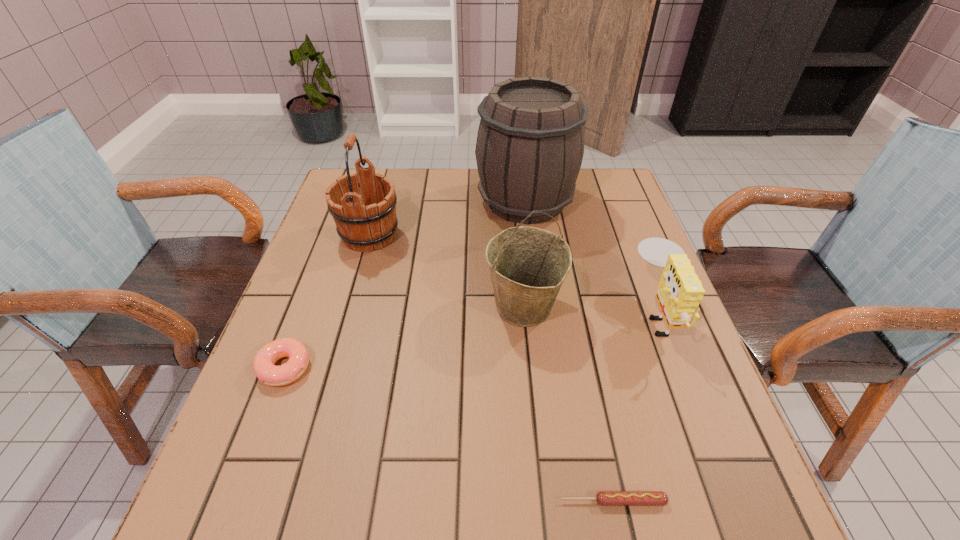
This screenshot has height=540, width=960. What are the coordinates of `sausage that is positioned at the right edge` in the screenshot? It's located at (604, 498).

I want to click on object positioned at the far right corner, so (530, 144).

Identify the location of object that is at the near right corner. (604, 498).

Locate an element on the screen. The height and width of the screenshot is (540, 960). free space at the far edge of the desktop is located at coordinates (460, 211).

The width and height of the screenshot is (960, 540). I want to click on vacant space at the left edge of the desktop, so click(292, 442).

Locate an element on the screen. vacant space at the right edge is located at coordinates (675, 370).

This screenshot has width=960, height=540. Identify the location of vacant position at the far right corner of the desktop. (601, 168).

Where is `free space between the nearest wine bucket and the leftmost wine bucket`? free space between the nearest wine bucket and the leftmost wine bucket is located at coordinates (446, 271).

Locate an element on the screen. free space between the nearest object and the third shortest object is located at coordinates (636, 408).

Locate an element on the screen. This screenshot has height=540, width=960. unoccupied position between the sponge and the shortest object is located at coordinates (636, 408).